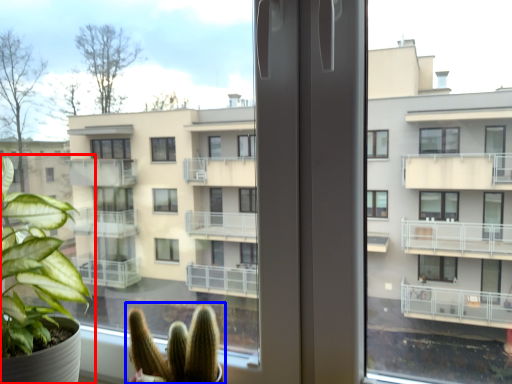
Question: Which of the following is the farthest to the observer, houseplant (highlighted by a red box) or houseplant (highlighted by a blue box)?

Choices:
 (A) houseplant
 (B) houseplant

Answer: (B)